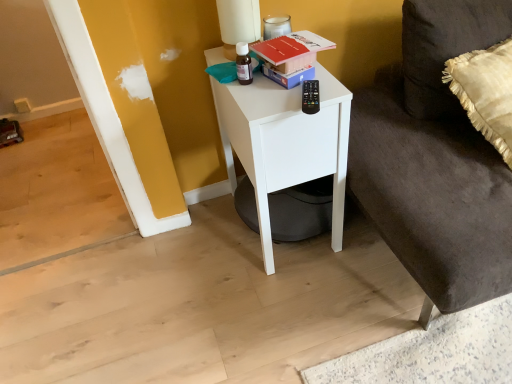
This screenshot has height=384, width=512. Describe the element at coordinates (285, 143) in the screenshot. I see `white matte nightstand at center` at that location.

Identify the location of dark gray fabric couch at lower right. (435, 160).

Identify the location of white matte nightstand at center. This screenshot has height=384, width=512. (285, 143).

Is red matte book at upper center not close to silky beige pillow at right?

red matte book at upper center is actually quite close to silky beige pillow at right.

From a real-world perspective, is red matte book at upper center below silky beige pillow at right?

Incorrect, from a real-world perspective, red matte book at upper center is higher than silky beige pillow at right.

In the image, is red matte book at upper center positioned in front of or behind silky beige pillow at right?

In the image, red matte book at upper center appears behind silky beige pillow at right.

Is red matte book at upper center situated inside silky beige pillow at right or outside?

red matte book at upper center lies outside silky beige pillow at right.

Is dark gray fabric couch at lower right not within red matte book at upper center?

Absolutely, dark gray fabric couch at lower right is external to red matte book at upper center.

Considering the sizes of dark gray fabric couch at lower right and red matte book at upper center in the image, is dark gray fabric couch at lower right bigger or smaller than red matte book at upper center?

Considering their sizes, dark gray fabric couch at lower right takes up more space than red matte book at upper center.

From a real-world perspective, between dark gray fabric couch at lower right and red matte book at upper center, who is vertically lower?

dark gray fabric couch at lower right, from a real-world perspective.

Considering the sizes of objects white matte nightstand at center and matte white table lamp at upper center in the image provided, who is taller, white matte nightstand at center or matte white table lamp at upper center?

white matte nightstand at center is taller.

From a real-world perspective, which is physically below, white matte nightstand at center or matte white table lamp at upper center?

In real-world perspective, white matte nightstand at center is lower.

Is white matte nightstand at center not close to matte white table lamp at upper center?

They are positioned close to each other.

Does red matte book at upper center have a larger size compared to white matte nightstand at center?

Actually, red matte book at upper center might be smaller than white matte nightstand at center.

From a real-world perspective, which object rests below the other?

white matte nightstand at center.

Considering the relative sizes of red matte book at upper center and white matte nightstand at center in the image provided, is red matte book at upper center taller than white matte nightstand at center?

No, red matte book at upper center is not taller than white matte nightstand at center.

Which is behind, red matte book at upper center or white matte nightstand at center?

Result: red matte book at upper center.

Considering the sizes of objects white matte nightstand at center and red matte book at upper center in the image provided, who is bigger, white matte nightstand at center or red matte book at upper center?

Bigger between the two is white matte nightstand at center.

Considering the positions of points (221, 111) and (316, 43), is point (221, 111) farther from camera compared to point (316, 43)?

Yes, it is.

Is white matte nightstand at center positioned with its back to red matte book at upper center?

That's not correct — white matte nightstand at center is not looking away from red matte book at upper center.

Which of these two, white matte nightstand at center or red matte book at upper center, is thinner?

red matte book at upper center.

Is matte white table lamp at upper center inside the boundaries of dark gray fabric couch at lower right, or outside?

matte white table lamp at upper center exists outside the volume of dark gray fabric couch at lower right.

Which object is further away from the camera taking this photo, matte white table lamp at upper center or dark gray fabric couch at lower right?

matte white table lamp at upper center is further from the camera.

Can you confirm if matte white table lamp at upper center is bigger than dark gray fabric couch at lower right?

Actually, matte white table lamp at upper center might be smaller than dark gray fabric couch at lower right.

Which is behind, point (239, 8) or point (410, 161)?

The point (410, 161) is behind.

Is dark gray fabric couch at lower right wider than white matte nightstand at center?

Yes, dark gray fabric couch at lower right is wider than white matte nightstand at center.

Considering the relative positions of dark gray fabric couch at lower right and white matte nightstand at center in the image provided, is dark gray fabric couch at lower right to the left or to the right of white matte nightstand at center?

Clearly, dark gray fabric couch at lower right is on the right of white matte nightstand at center in the image.

Does point (386, 153) come farther from viewer compared to point (323, 127)?

That is True.

How many degrees apart are the facing directions of dark gray fabric couch at lower right and white matte nightstand at center?

The angle between the facing direction of dark gray fabric couch at lower right and the facing direction of white matte nightstand at center is 5.44 degrees.

You are a GUI agent. You are given a task and a screenshot of the screen. Output one action in this format:
    pyautogui.click(x=<x>, y=<y>)
    Task: Click on the pillow below the red matte book at upper center (from the image's perspective)
    The image size is (512, 384).
    Given the screenshot: What is the action you would take?
    pyautogui.click(x=445, y=47)

Where is `book located behind the dark gray fabric couch at lower right`? This screenshot has height=384, width=512. book located behind the dark gray fabric couch at lower right is located at coordinates (292, 50).

Which object lies nearer to the anchor point dark gray fabric couch at lower right, white matte nightstand at center or matte white table lamp at upper center?

Among the two, white matte nightstand at center is located nearer to dark gray fabric couch at lower right.

Estimate the real-world distances between objects in this image. Which object is closer to dark gray fabric couch at lower right, matte white table lamp at upper center or white matte nightstand at center?

white matte nightstand at center is closer to dark gray fabric couch at lower right.

Which object lies nearer to the anchor point red matte book at upper center, silky beige pillow at right or white matte nightstand at center?

white matte nightstand at center is closer to red matte book at upper center.

From the image, which object appears to be farther from red matte book at upper center, dark gray fabric couch at lower right or white matte nightstand at center?

dark gray fabric couch at lower right is positioned further to the anchor red matte book at upper center.

From the image, which object appears to be farther from red matte book at upper center, white matte nightstand at center or silky beige pillow at right?

silky beige pillow at right is further to red matte book at upper center.

Looking at the image, which one is located closer to white matte nightstand at center, dark gray fabric couch at lower right or red matte book at upper center?

red matte book at upper center is closer to white matte nightstand at center.

Estimate the real-world distances between objects in this image. Which object is further from white matte nightstand at center, matte white table lamp at upper center or dark gray fabric couch at lower right?

Among the two, dark gray fabric couch at lower right is located further to white matte nightstand at center.

Looking at this image, considering their positions, is dark gray fabric couch at lower right positioned closer to silky beige pillow at right than matte white table lamp at upper center?

The object closer to silky beige pillow at right is dark gray fabric couch at lower right.

This screenshot has height=384, width=512. In order to click on pillow situated between matte white table lamp at upper center and dark gray fabric couch at lower right from left to right in this screenshot , I will do `click(445, 47)`.

Find the location of `nightstand located between matte white table lamp at upper center and dark gray fabric couch at lower right in the left-right direction`. nightstand located between matte white table lamp at upper center and dark gray fabric couch at lower right in the left-right direction is located at coordinates (x=285, y=143).

At what (x,y) coordinates should I click in order to perform the action: click on book between white matte nightstand at center and dark gray fabric couch at lower right. Please return your answer as a coordinate pair (x, y). The width and height of the screenshot is (512, 384). Looking at the image, I should click on (292, 50).

The width and height of the screenshot is (512, 384). In order to click on pillow between white matte nightstand at center and dark gray fabric couch at lower right from left to right in this screenshot , I will do `click(445, 47)`.